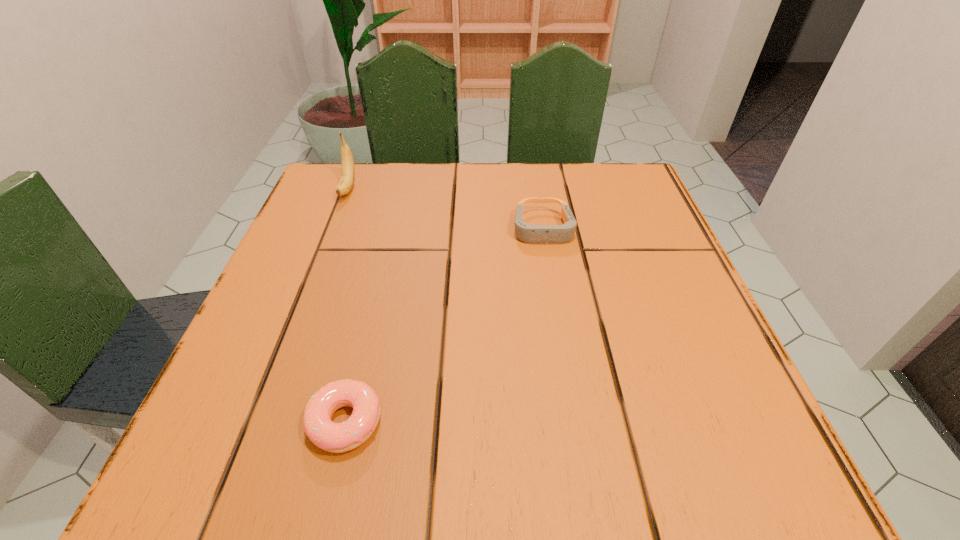
You are a GUI agent. You are given a task and a screenshot of the screen. Output one action in this format:
    pyautogui.click(x=<x>, y=<y>)
    Task: Click on the goggles present at the far edge
    Image resolution: width=960 pixels, height=540 pixels.
    Given the screenshot: What is the action you would take?
    pyautogui.click(x=536, y=234)

Find the location of `object that is at the near edge`. object that is at the near edge is located at coordinates (333, 437).

At what (x,y) coordinates should I click in order to perform the action: click on banana located in the left edge section of the desktop. Please return your answer as a coordinate pair (x, y). This screenshot has width=960, height=540. Looking at the image, I should click on (345, 184).

Image resolution: width=960 pixels, height=540 pixels. What are the coordinates of `doughnut at the left edge` in the screenshot? It's located at (333, 437).

In order to click on object that is at the far left corner in this screenshot , I will do `click(345, 184)`.

Identify the location of object at the near left corner. The height and width of the screenshot is (540, 960). (333, 437).

You are a GUI agent. You are given a task and a screenshot of the screen. Output one action in this format:
    pyautogui.click(x=<x>, y=<y>)
    Task: Click on the free region at the far edge
    The image size is (960, 540).
    Given the screenshot: What is the action you would take?
    pyautogui.click(x=439, y=163)

This screenshot has width=960, height=540. In the image, there is a desktop. Identify the location of free region at the near edge. (333, 416).

Identify the location of vacant position at the left edge of the desktop. (308, 269).

Identify the location of free space at the right edge of the desktop. (617, 301).